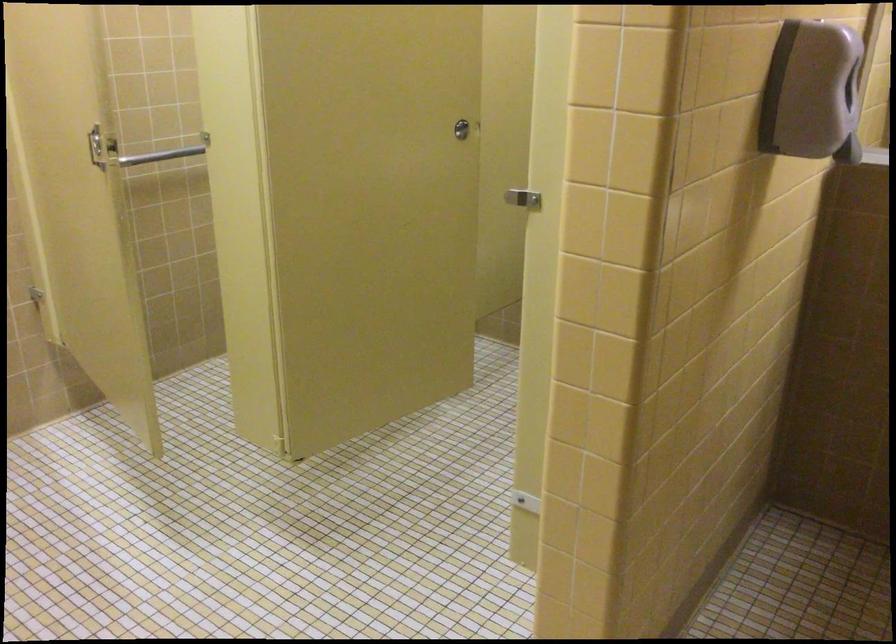
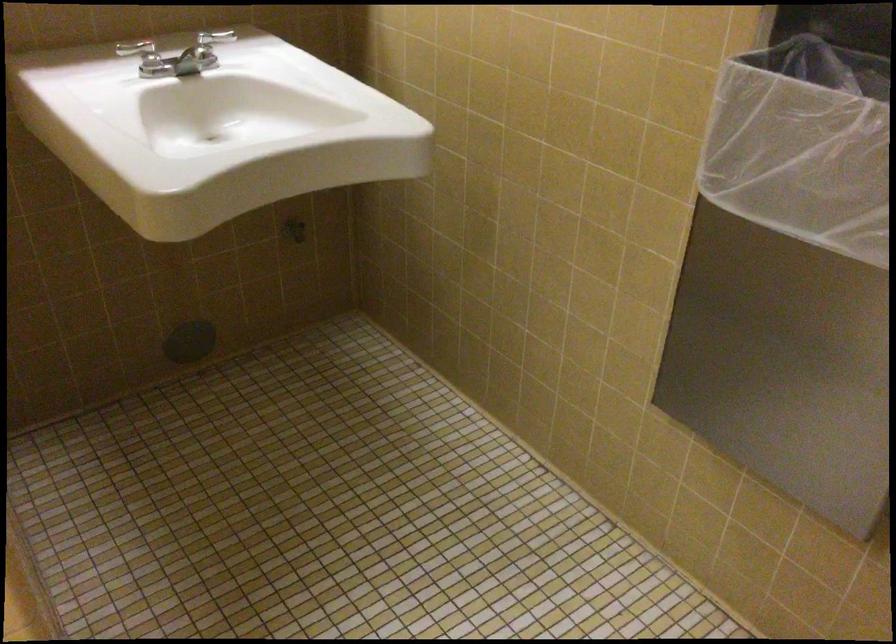
The images are taken continuously from a first-person perspective. In which direction is your viewpoint rotating?

The rotation direction of the camera is right-down.